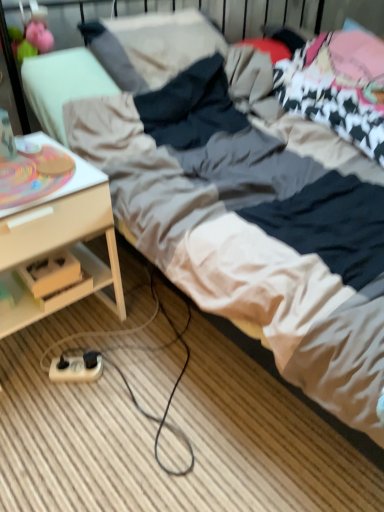
Question: From the image's perspective, is beige plastic extension cord at lower left below white wood desk at lower left?

Choices:
 (A) no
 (B) yes

Answer: (B)

Question: From a real-world perspective, is beige plastic extension cord at lower left located beneath white wood desk at lower left?

Choices:
 (A) no
 (B) yes

Answer: (B)

Question: Does beige plastic extension cord at lower left have a greater width compared to white wood desk at lower left?

Choices:
 (A) yes
 (B) no

Answer: (B)

Question: Can you confirm if beige plastic extension cord at lower left is bigger than white wood desk at lower left?

Choices:
 (A) no
 (B) yes

Answer: (A)

Question: Is beige plastic extension cord at lower left surrounding white wood desk at lower left?

Choices:
 (A) no
 (B) yes

Answer: (A)

Question: Is beige plastic extension cord at lower left closer to the viewer compared to white wood desk at lower left?

Choices:
 (A) no
 (B) yes

Answer: (A)

Question: From the image's perspective, is white wood desk at lower left located above beige plastic extension cord at lower left?

Choices:
 (A) no
 (B) yes

Answer: (B)

Question: Considering the relative sizes of white wood desk at lower left and beige plastic extension cord at lower left in the image provided, is white wood desk at lower left shorter than beige plastic extension cord at lower left?

Choices:
 (A) yes
 (B) no

Answer: (B)

Question: Can you confirm if white wood desk at lower left is positioned to the left of beige plastic extension cord at lower left?

Choices:
 (A) yes
 (B) no

Answer: (A)

Question: From a real-world perspective, is white wood desk at lower left beneath beige plastic extension cord at lower left?

Choices:
 (A) no
 (B) yes

Answer: (A)

Question: Is white wood desk at lower left aimed at beige plastic extension cord at lower left?

Choices:
 (A) yes
 (B) no

Answer: (A)

Question: Does white wood desk at lower left come behind beige plastic extension cord at lower left?

Choices:
 (A) yes
 (B) no

Answer: (B)

Question: Looking at their shapes, would you say white wood desk at lower left is wider or thinner than beige plastic extension cord at lower left?

Choices:
 (A) wide
 (B) thin

Answer: (A)